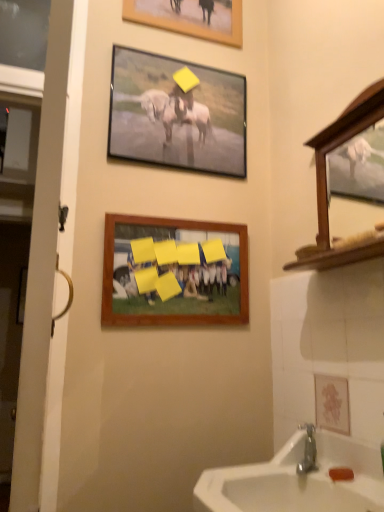
Question: Which is correct: white wooden door at left is inside wooden picture frame at center, positioned as the 3th picture frame in top-to-bottom order, or outside of it?

Choices:
 (A) inside
 (B) outside

Answer: (B)

Question: Does point (49, 329) appear closer or farther from the camera than point (206, 236)?

Choices:
 (A) closer
 (B) farther

Answer: (A)

Question: Based on their relative distances, which object is farther from the white wooden door at left?

Choices:
 (A) white ceramic sink at lower right
 (B) wooden picture frame at center, which is counted as the first picture frame, starting from the bottom
 (C) wooden picture frame at upper center, placed as the first picture frame when sorted from top to bottom
 (D) metallic silver frame at upper center, positioned as the 2th picture frame in top-to-bottom order

Answer: (C)

Question: Based on their relative distances, which object is nearer to the wooden picture frame at upper center, placed as the first picture frame when sorted from top to bottom?

Choices:
 (A) white ceramic sink at lower right
 (B) metallic silver frame at upper center, positioned as the 2th picture frame in top-to-bottom order
 (C) white wooden door at left
 (D) wooden picture frame at center, which is counted as the first picture frame, starting from the bottom

Answer: (B)